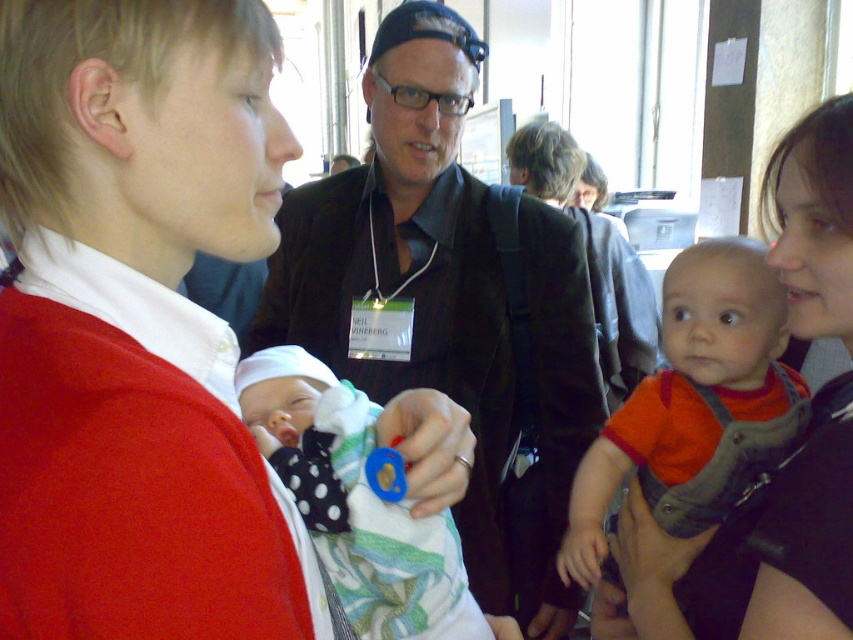
Question: Is matte black baby carrier at center wider than blue rubber teething ring at center?

Choices:
 (A) no
 (B) yes

Answer: (B)

Question: Which of the following is the closest to the observer?

Choices:
 (A) (822, 145)
 (B) (315, 538)

Answer: (B)

Question: Considering the real-world distances, which object is closest to the blue rubber teething ring at center?

Choices:
 (A) blue rubber pacifier at center
 (B) matte black shirt at center
 (C) matte black baby carrier at center

Answer: (A)

Question: Is blue rubber pacifier at center smaller than blue rubber teething ring at center?

Choices:
 (A) no
 (B) yes

Answer: (A)

Question: Is matte black baby carrier at center smaller than blue rubber teething ring at center?

Choices:
 (A) yes
 (B) no

Answer: (B)

Question: Among these points, which one is farthest from the camera?

Choices:
 (A) (314, 497)
 (B) (596, 600)
 (C) (463, 465)

Answer: (B)